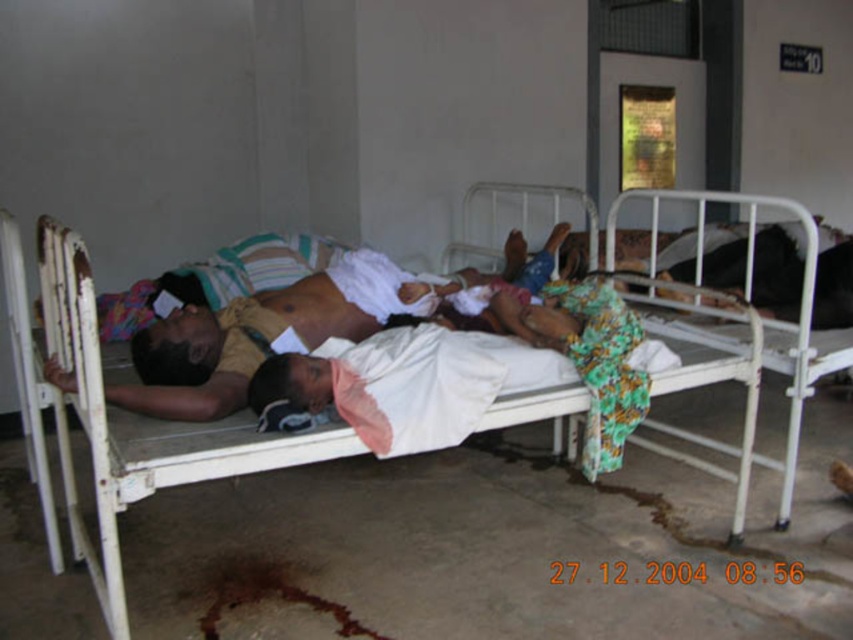
Question: Is white metal bed at center further to camera compared to light brown fabric shirt at center?

Choices:
 (A) yes
 (B) no

Answer: (B)

Question: Which point is farther to the camera?

Choices:
 (A) white metal bed at center
 (B) light brown fabric shirt at center

Answer: (B)

Question: Can you confirm if white metal bed at center is positioned to the left of light brown fabric shirt at center?

Choices:
 (A) no
 (B) yes

Answer: (B)

Question: Is the position of white metal bed at center less distant than that of light brown fabric shirt at center?

Choices:
 (A) yes
 (B) no

Answer: (A)